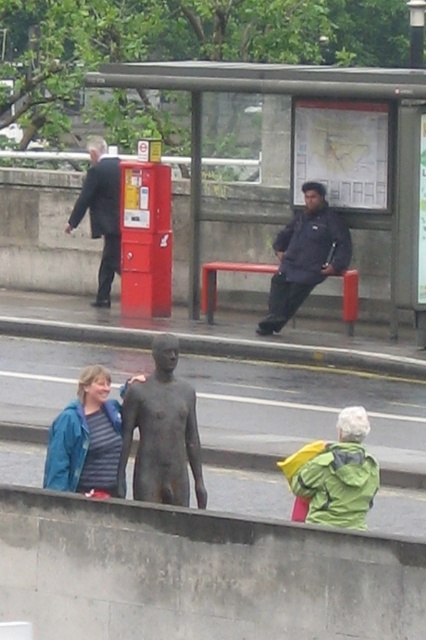
Is metallic red bench at center thinner than dark suit at left?

No.

Does point (221, 236) come farther from viewer compared to point (104, 234)?

That is True.

Where is `metallic red bench at center`? Image resolution: width=426 pixels, height=640 pixels. metallic red bench at center is located at coordinates (313, 168).

Is the position of metallic red bench at center more distant than that of matte blue jacket at lower left?

Yes, metallic red bench at center is behind matte blue jacket at lower left.

Consider the image. Which of these two, metallic red bench at center or matte blue jacket at lower left, stands taller?

metallic red bench at center is taller.

At what (x,y) coordinates should I click in order to perform the action: click on metallic red bench at center. Please return your answer as a coordinate pair (x, y). Looking at the image, I should click on (313, 168).

Is point (108, 397) in front of point (278, 310)?

Yes, point (108, 397) is in front of point (278, 310).

Does matte blue jacket at lower left appear on the left side of dark blue jacket at center?

Indeed, matte blue jacket at lower left is positioned on the left side of dark blue jacket at center.

Find the location of a particular element. The image size is (426, 640). matte blue jacket at lower left is located at coordinates (86, 438).